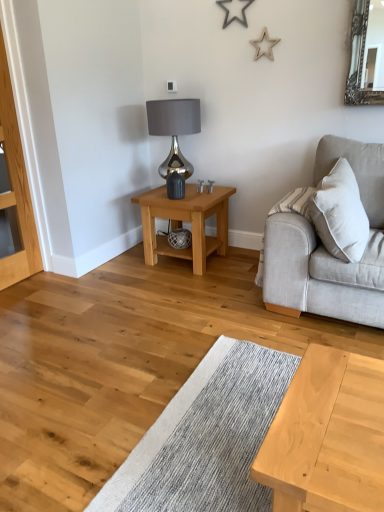
Question: Looking at their shapes, would you say light brown wooden table at center is wider or thinner than satin silver lamp at upper center?

Choices:
 (A) wide
 (B) thin

Answer: (A)

Question: Is light brown wooden table at center in front of or behind satin silver lamp at upper center in the image?

Choices:
 (A) behind
 (B) front

Answer: (B)

Question: Based on their relative distances, which object is nearer to the light brown wooden table at center?

Choices:
 (A) satin silver lamp at upper center
 (B) light gray fabric couch at right
 (C) light oak dresser at left

Answer: (A)

Question: Which object is the farthest from the satin silver lamp at upper center?

Choices:
 (A) light oak dresser at left
 (B) light gray fabric couch at right
 (C) light brown wooden table at center

Answer: (B)